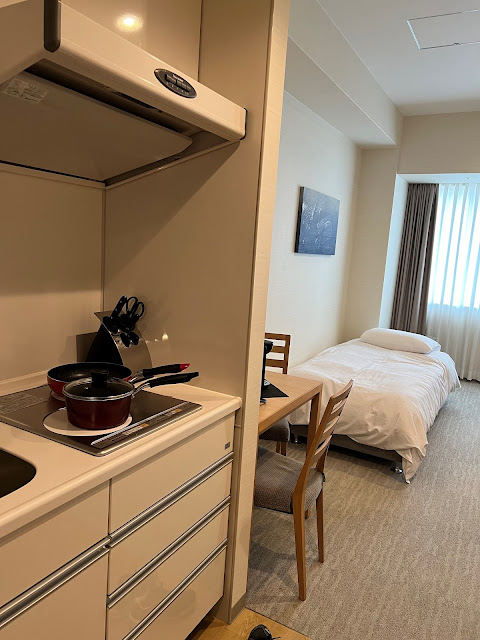
Identify the location of ceiling. (384, 35).